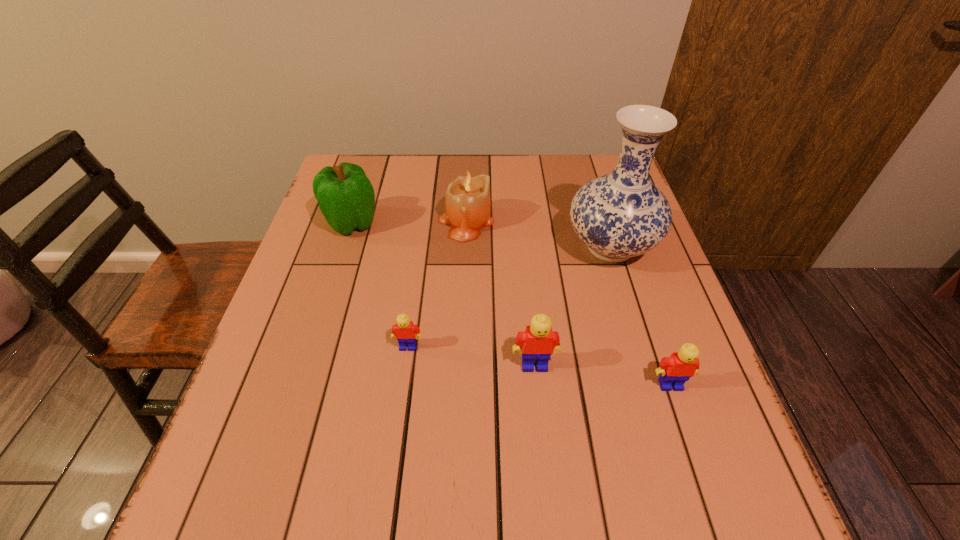
In order to click on the fifth object from right to left in this screenshot , I will do point(404,330).

At what (x,y) coordinates should I click in order to perform the action: click on the farthest Lego. Please return your answer as a coordinate pair (x, y). The image size is (960, 540). Looking at the image, I should click on (404, 330).

Identify the location of the third object from right to left. The image size is (960, 540). (539, 341).

Locate an element on the screen. The image size is (960, 540). the second nearest Lego is located at coordinates (539, 341).

The image size is (960, 540). I want to click on the fifth tallest object, so (675, 370).

Identify the location of the rightmost Lego. (675, 370).

I want to click on the third object from left to right, so click(468, 207).

Image resolution: width=960 pixels, height=540 pixels. Identify the location of the leftmost object. (346, 198).

I want to click on vase, so pyautogui.click(x=619, y=215).

Identify the location of free space located 0.050m on the front-facing side of the farthest Lego. Image resolution: width=960 pixels, height=540 pixels. (404, 373).